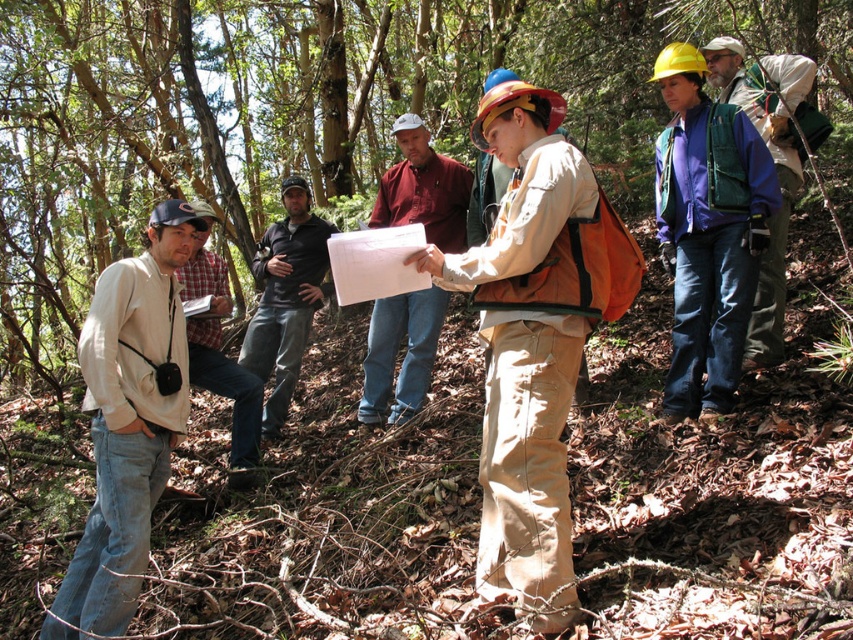
Question: Which point is farther to the camera?

Choices:
 (A) (495, 116)
 (B) (265, 403)
 (C) (154, 432)

Answer: (B)

Question: Can you confirm if black cotton shirt at center is positioned to the right of green fabric vest at right?

Choices:
 (A) yes
 (B) no

Answer: (B)

Question: Among these objects, which one is nearest to the camera?

Choices:
 (A) maroon cotton shirt at center
 (B) black cotton shirt at center

Answer: (A)

Question: Considering the relative positions of maroon cotton shirt at center and black cotton shirt at center in the image provided, where is maroon cotton shirt at center located with respect to black cotton shirt at center?

Choices:
 (A) above
 (B) below

Answer: (B)

Question: Can you confirm if khaki cotton pants at center is wider than black cotton shirt at center?

Choices:
 (A) no
 (B) yes

Answer: (A)

Question: Which point is closer to the camera?

Choices:
 (A) (148, 429)
 (B) (276, 362)

Answer: (A)